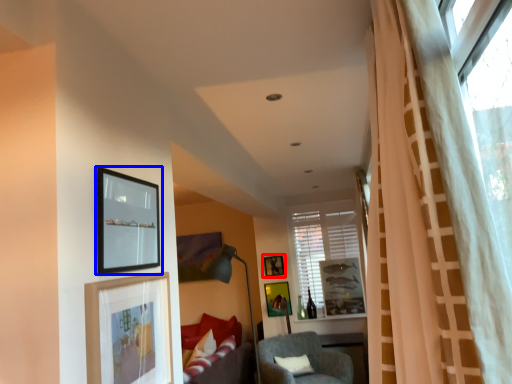
Question: Which object is closer to the camera taking this photo, picture frame (highlighted by a red box) or picture frame (highlighted by a blue box)?

Choices:
 (A) picture frame
 (B) picture frame

Answer: (B)